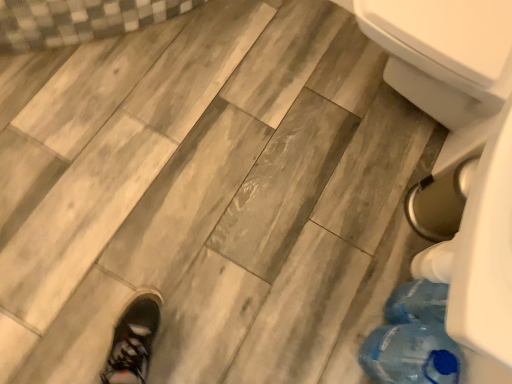
The image size is (512, 384). In order to click on vacant position to the left of transparent plastic bottle at lower right in this screenshot , I will do `click(322, 332)`.